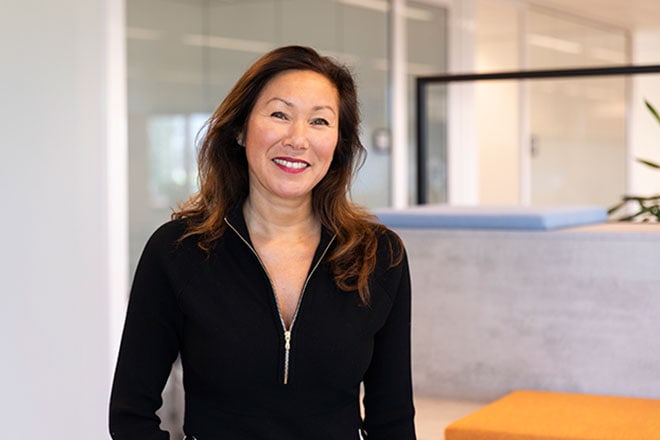
Find the location of `doorway in background`. doorway in background is located at coordinates (583, 139).